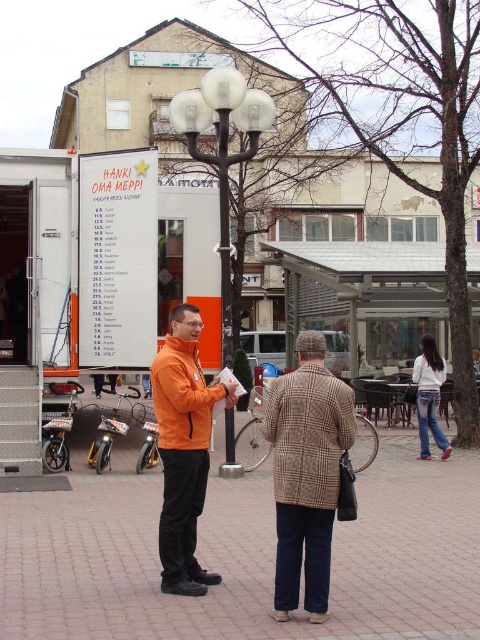
Can you confirm if orange matte jacket at center is thinner than white denim jeans at lower right?

Correct, orange matte jacket at center's width is less than white denim jeans at lower right's.

Does orange matte jacket at center have a greater height compared to white denim jeans at lower right?

Correct, orange matte jacket at center is much taller as white denim jeans at lower right.

Identify the location of orange matte jacket at center. (183, 449).

Does brick pavement at center have a smaller size compared to orange matte jacket at center?

Yes, brick pavement at center is smaller than orange matte jacket at center.

Which is in front, point (236, 632) or point (180, 419)?

Point (236, 632) is more forward.

Identify the location of brick pavement at center. The width and height of the screenshot is (480, 640). (245, 557).

Does point (216, 134) come farther from viewer compared to point (419, 374)?

Yes, it is.

Does point (201, 84) lie in front of point (420, 369)?

No.

Between point (188, 92) and point (444, 372), which one is positioned in front?

Point (188, 92) is more forward.

Image resolution: width=480 pixels, height=640 pixels. I want to click on white glass lamp post at center, so click(x=223, y=150).